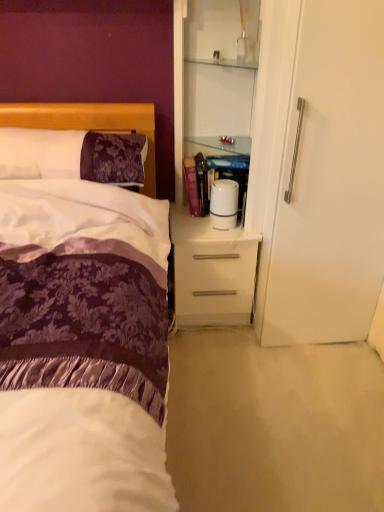
Question: Is white glossy nightstand at center bigger or smaller than purple damask pillow at left?

Choices:
 (A) big
 (B) small

Answer: (A)

Question: From the image's perspective, is white glossy nightstand at center located above or below purple damask pillow at left?

Choices:
 (A) below
 (B) above

Answer: (A)

Question: Based on their relative distances, which object is nearer to the white glossy nightstand at center?

Choices:
 (A) purple damask pillow at left
 (B) white glossy cabinet at upper right

Answer: (B)

Question: Estimate the real-world distances between objects in this image. Which object is farther from the white glossy nightstand at center?

Choices:
 (A) purple damask pillow at left
 (B) white glossy cabinet at upper right

Answer: (A)